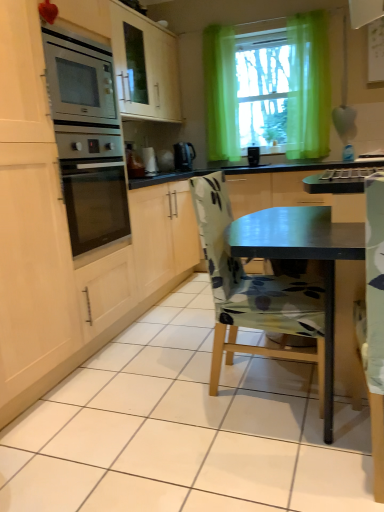
Question: From a real-world perspective, is white glossy kettle at center physically located above or below green sheer curtain at upper center?

Choices:
 (A) above
 (B) below

Answer: (B)

Question: Is point (155, 173) positioned closer to the camera than point (291, 26)?

Choices:
 (A) closer
 (B) farther

Answer: (A)

Question: Which of these objects is positioned farthest from the green sheer curtain at upper center?

Choices:
 (A) white glossy kettle at center
 (B) black plastic kettle at center
 (C) green sheer curtain at upper center
 (D) floral fabric chair at center

Answer: (D)

Question: Estimate the real-world distances between objects in this image. Which object is farther from the floral fabric chair at center?

Choices:
 (A) white glossy kettle at center
 (B) green sheer curtain at upper center
 (C) black plastic kettle at center
 (D) green sheer curtain at upper center

Answer: (B)